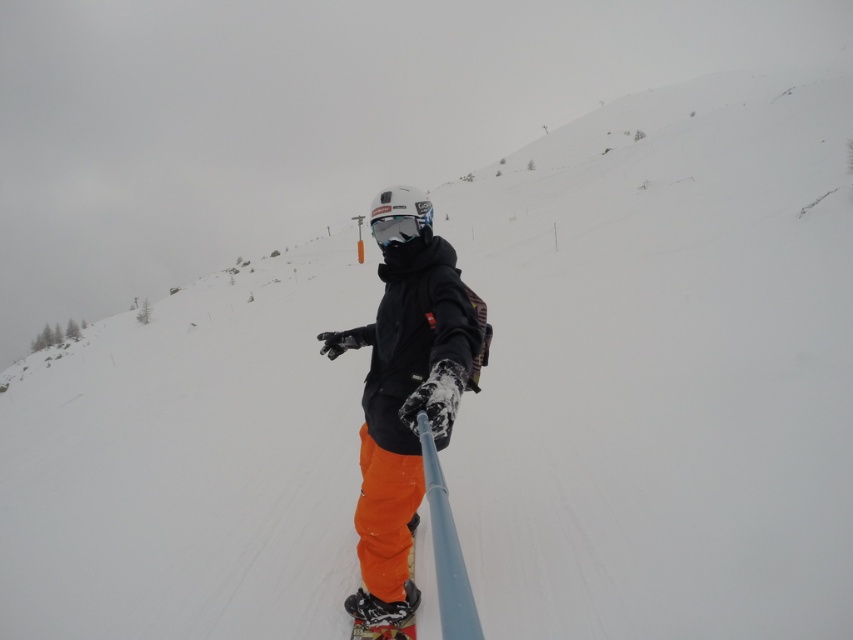
Question: Which of the following is the farthest from the observer?

Choices:
 (A) click(x=392, y=227)
 (B) click(x=436, y=445)
 (C) click(x=409, y=557)

Answer: (C)

Question: Can you confirm if orange snow pants at center is wider than transparent plastic goggles at center?

Choices:
 (A) no
 (B) yes

Answer: (B)

Question: Based on their relative distances, which object is farther from the orange matte snowboard at lower center?

Choices:
 (A) transparent plastic goggles at center
 (B) orange snow pants at center

Answer: (A)

Question: Where is orange snow pants at center located in relation to transparent plastic goggles at center in the image?

Choices:
 (A) right
 (B) left

Answer: (A)

Question: Which point is farther to the camera?

Choices:
 (A) (407, 218)
 (B) (409, 525)
 (C) (416, 516)

Answer: (C)

Question: Does orange snow pants at center appear on the left side of orange matte snowboard at lower center?

Choices:
 (A) no
 (B) yes

Answer: (A)